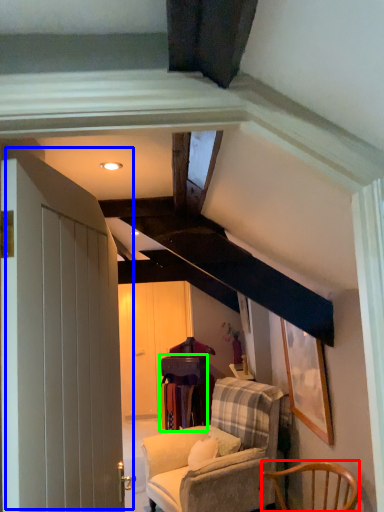
Question: Estimate the real-world distances between objects in this image. Which object is closer to chair (highlighted by a red box), door (highlighted by a blue box) or table (highlighted by a green box)?

Choices:
 (A) door
 (B) table

Answer: (A)